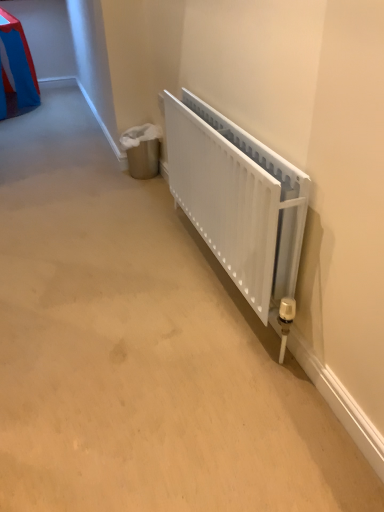
The height and width of the screenshot is (512, 384). In order to click on white matte radiator at right in this screenshot , I will do click(238, 199).

This screenshot has height=512, width=384. Describe the element at coordinates (238, 199) in the screenshot. I see `white matte radiator at right` at that location.

Identify the location of white matte radiator at right. (238, 199).